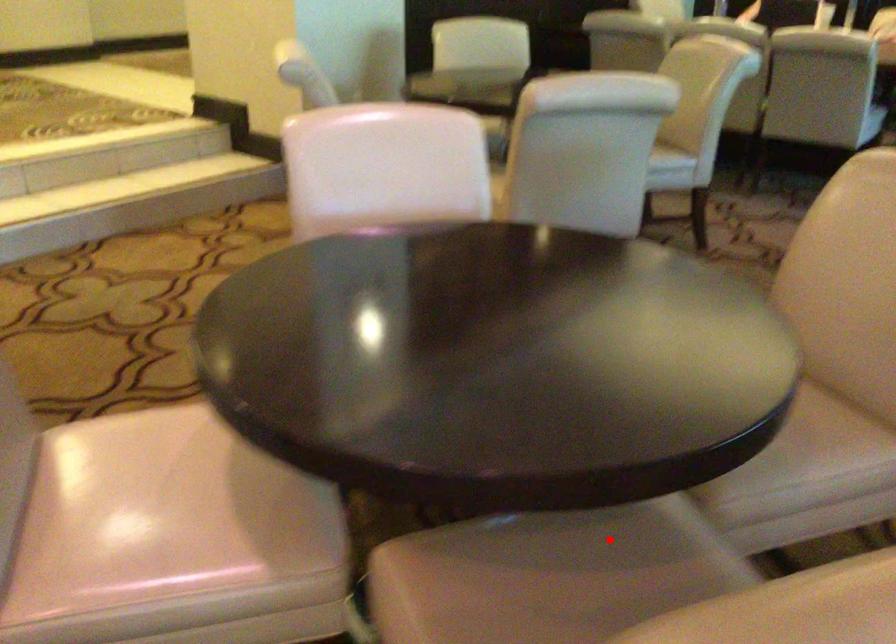
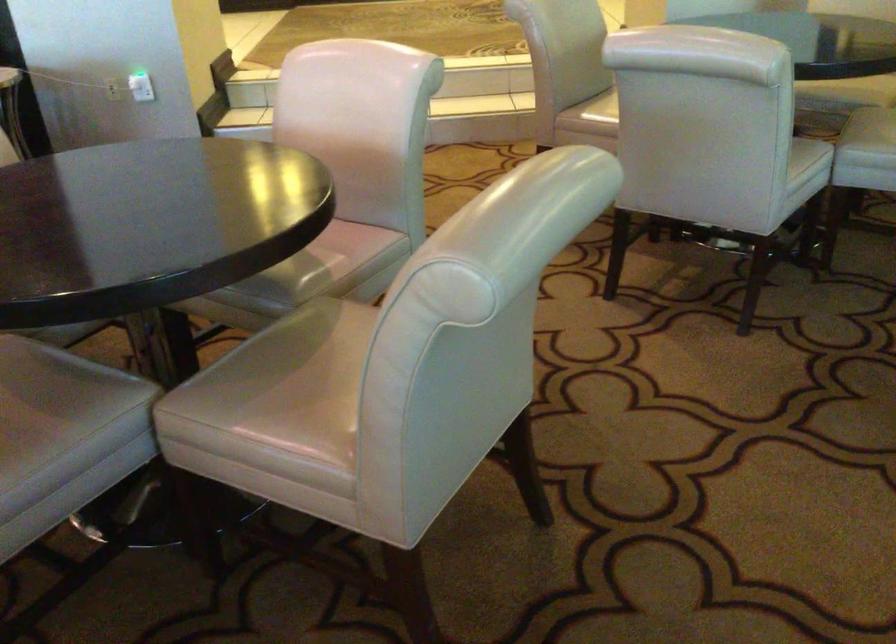
Question: I am providing you with two images of the same scene from different viewpoints. In image1, a red point is highlighted. Considering the same 3D point in image2, which of the following is correct?

Choices:
 (A) It is closer
 (B) It is farther

Answer: (B)